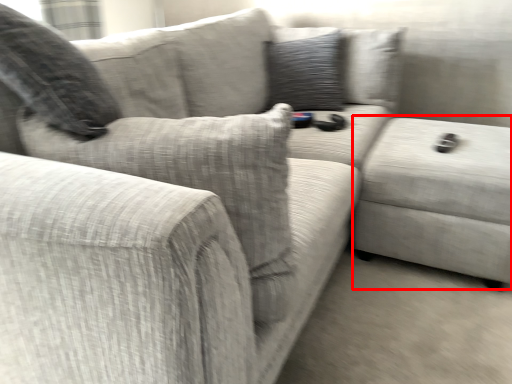
Question: Observing the image, what is the correct spatial positioning of gray (annotated by the red box) in reference to pillow?

Choices:
 (A) right
 (B) left

Answer: (A)